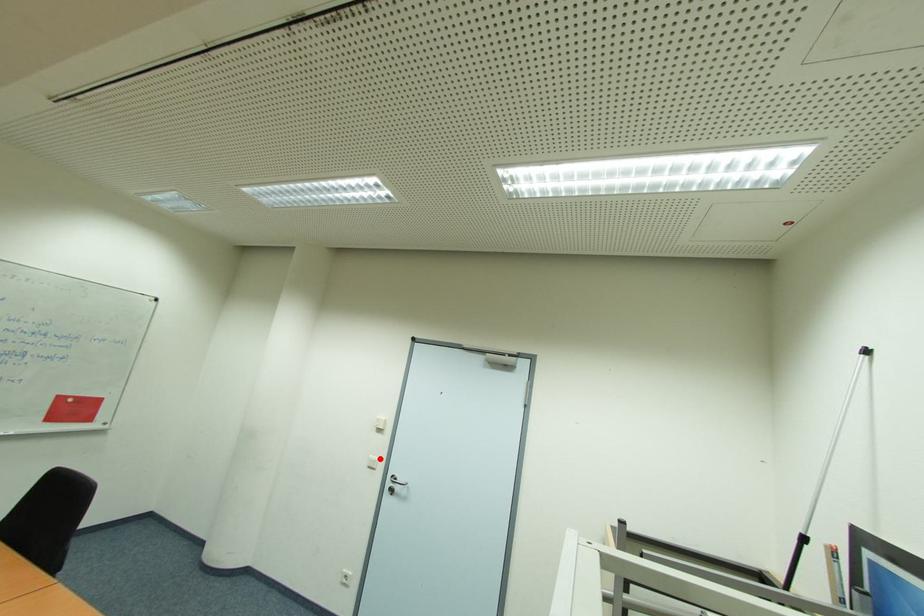
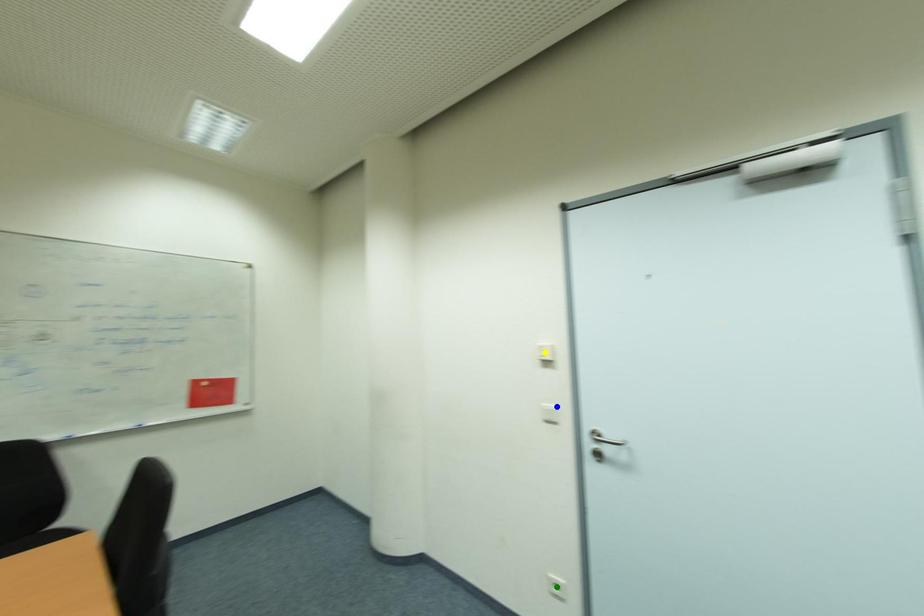
Question: I am providing you with two images of the same scene from different viewpoints. A red point is marked on the first image. You are given multiple points on the second image. Which point in image 2 is actually the same real-world point as the red point in image 1?

Choices:
 (A) yellow point
 (B) green point
 (C) blue point

Answer: (C)